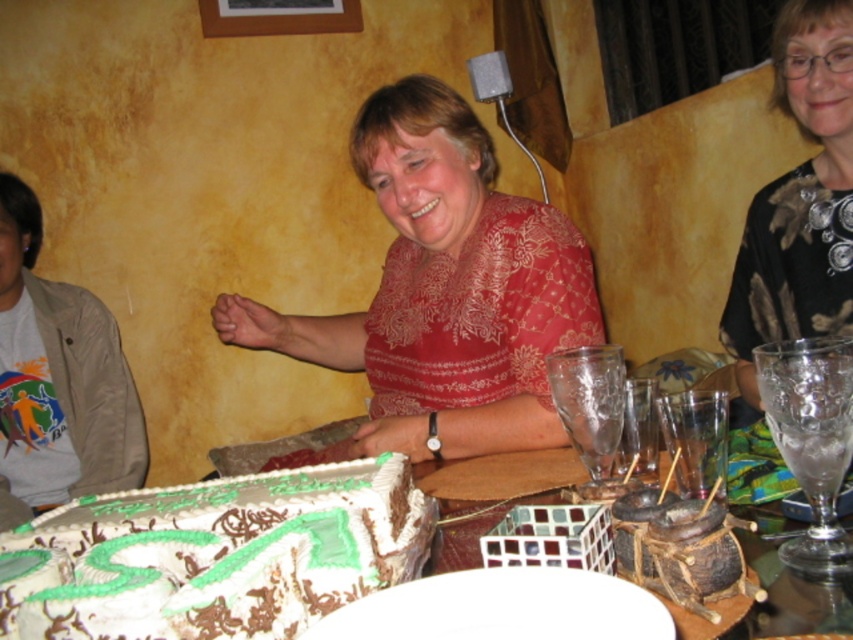
You are a photographer at the event and need to capture a photo that includes both the matte floral blouse at center and the black textured blouse at upper right. Which blouse should you adjust your camera focus to ensure both are in focus?

To ensure both the matte floral blouse at center and the black textured blouse at upper right are in focus, focus on the matte floral blouse at center since it is closer to the viewer than the black textured blouse at upper right.